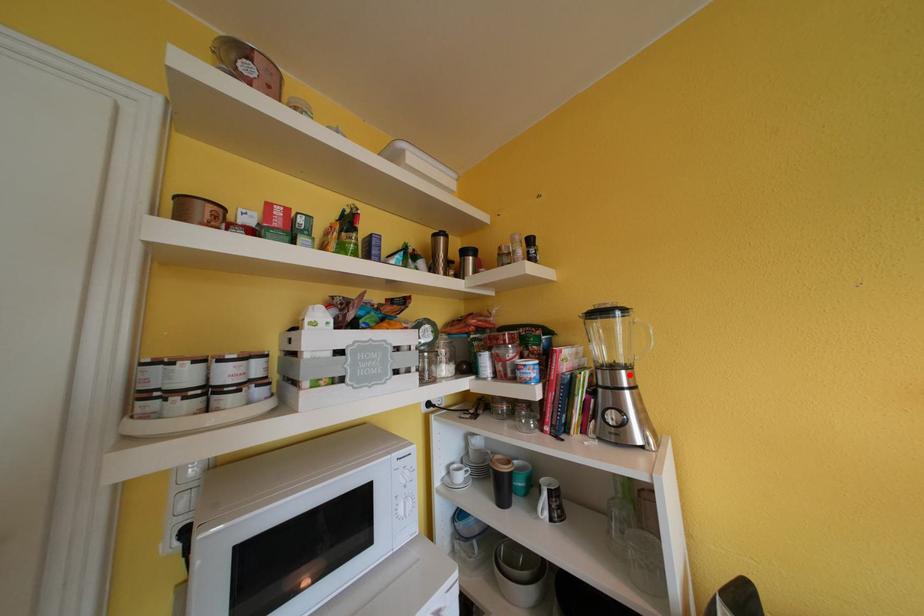
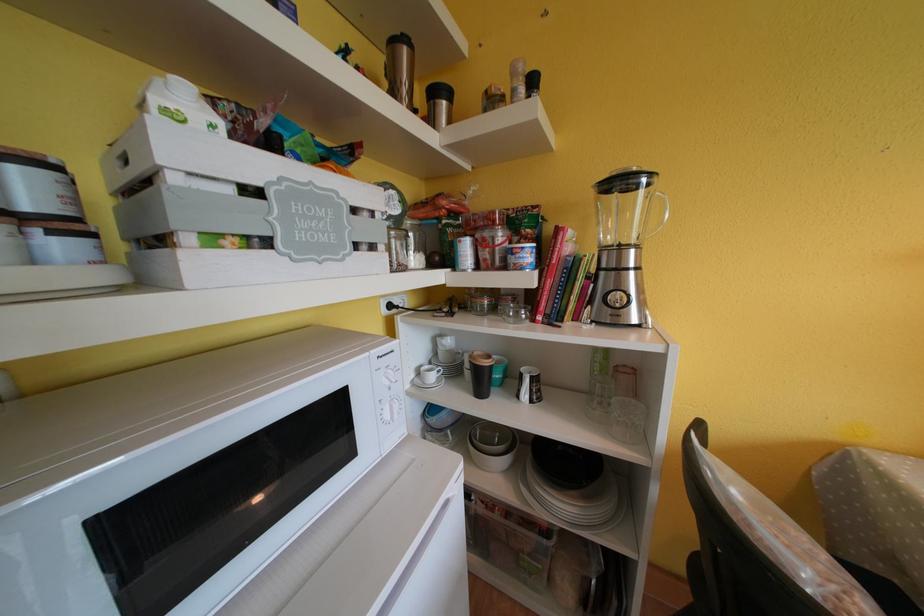
Locate, in the second image, the point that corresponds to the highlighted location in the first image.

(638, 254)